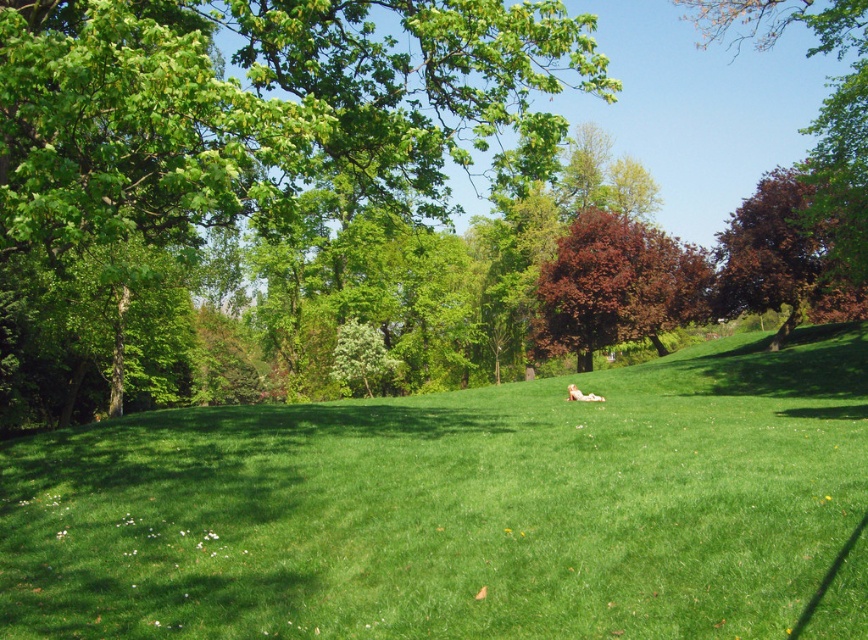
Based on the photo, you are a bird flying over the park and want to land on a tree. You see the green leafy tree at upper left and the dark brown textured tree at upper right. Which tree is positioned higher in the sky?

The green leafy tree at upper left is located above the dark brown textured tree at upper right, so it is positioned higher in the sky.

You are standing in the park and see two points marked in the scene. Which point is closer to you, point (843,257) or point (577,388)?

Point (843,257) is closer to the viewer than point (577,388).

You are standing at the center of the park and want to take a photo of the green leafy tree at upper left. Which direction should you face to ensure the tree is in the frame?

The green leafy tree at upper left is located at point 0.308 on the x and y axis, so you should face towards the upper left direction to capture it in your photo.